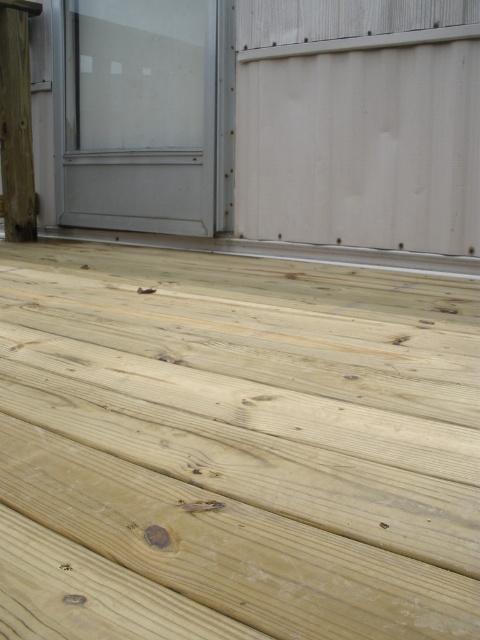
Which of these two, natural wood deck at center or natural wood post at left, stands taller?

natural wood post at left is taller.

Is natural wood deck at center to the left of natural wood post at left from the viewer's perspective?

Incorrect, natural wood deck at center is not on the left side of natural wood post at left.

What do you see at coordinates (236, 449) in the screenshot?
I see `natural wood deck at center` at bounding box center [236, 449].

Find the location of `natural wood deck at center`. natural wood deck at center is located at coordinates (236, 449).